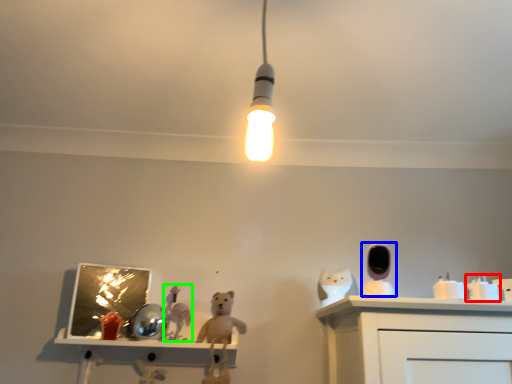
Question: Which object is positioned closest to toy (highlighted by a red box)? Select from toy (highlighted by a blue box) and toy (highlighted by a green box).

Choices:
 (A) toy
 (B) toy

Answer: (A)